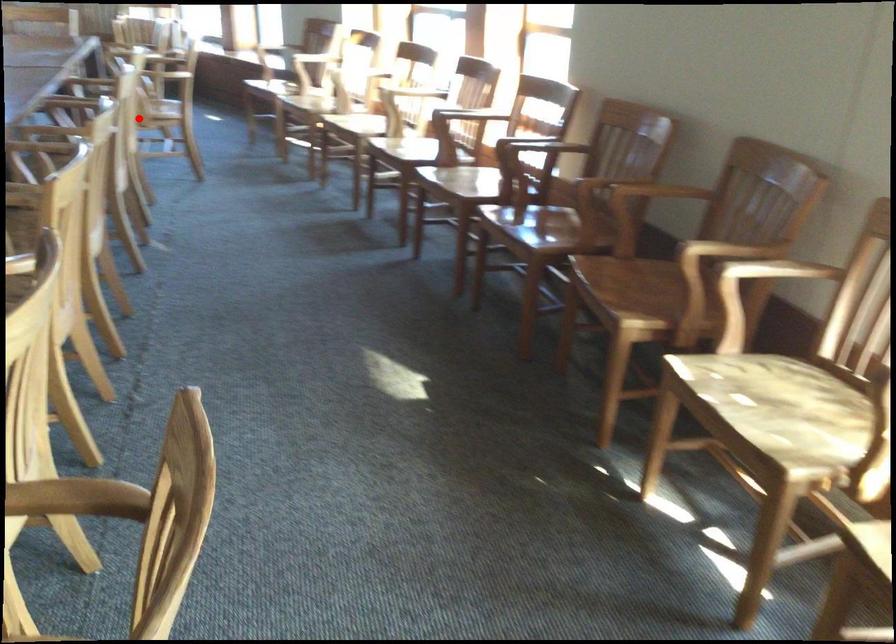
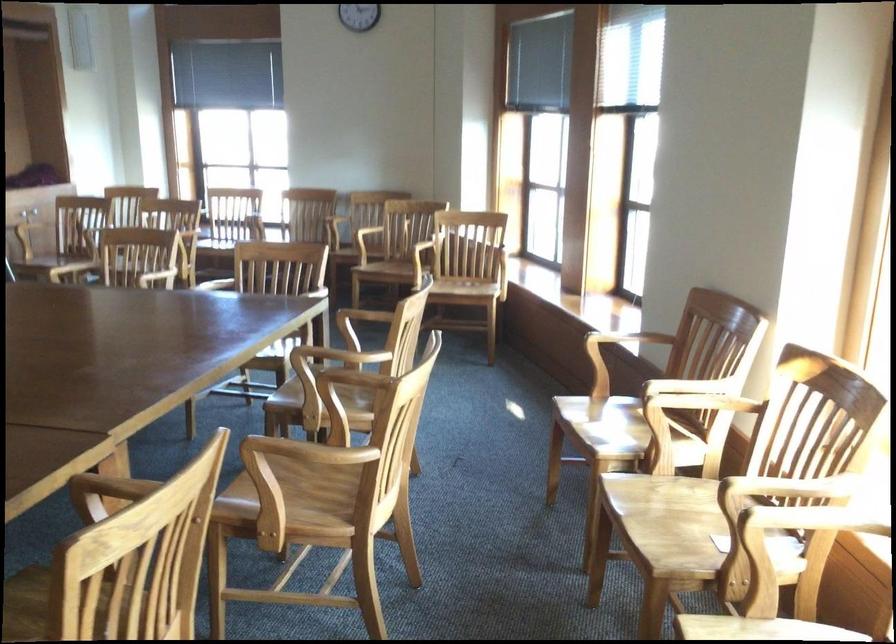
Question: I am providing you with two images of the same scene from different viewpoints. Given a red point in image1, look at the same physical point in image2. Is it:

Choices:
 (A) Closer to the viewpoint
 (B) Farther from the viewpoint

Answer: (A)